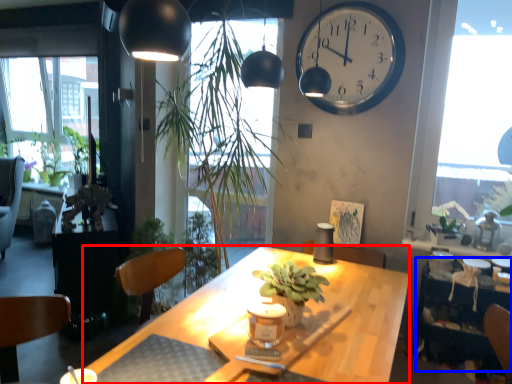
Question: Which of the following is the farthest to the observer, desk (highlighted by a red box) or table (highlighted by a blue box)?

Choices:
 (A) desk
 (B) table

Answer: (B)